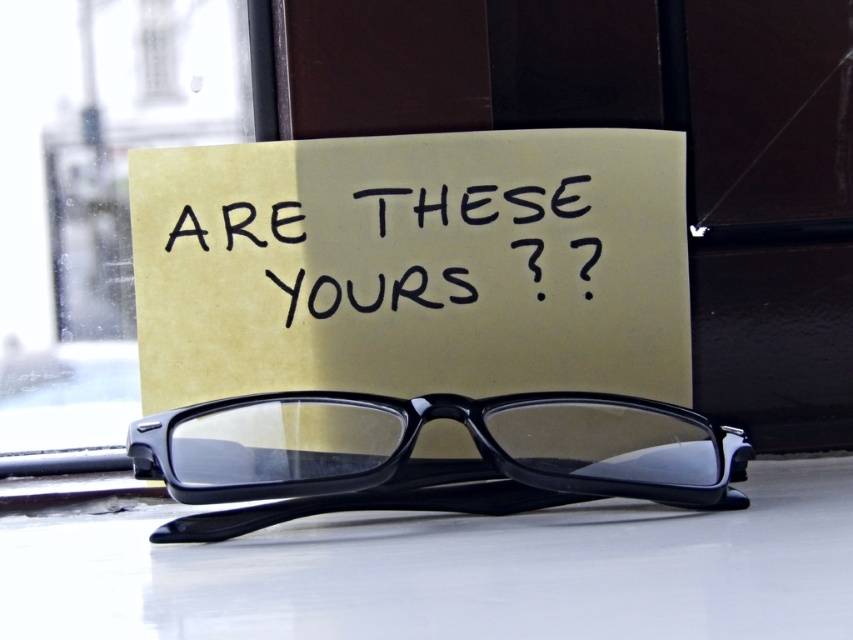
Consider the image. Who is more distant from viewer, (x=393, y=484) or (x=581, y=253)?

The point (x=581, y=253) is behind.

Identify the location of black plastic glasses at center. (428, 458).

Is transparent glass window at upper left positioned at the back of black plastic glasses at center?

Yes, it is.

Is point (200, 83) positioned before point (402, 461)?

No, it is not.

Does point (68, 369) come behind point (460, 481)?

Yes, point (68, 369) is behind point (460, 481).

Find the location of `transparent glass window at upper left`. transparent glass window at upper left is located at coordinates (102, 186).

Which is more to the left, yellow paper at center or transparent glass window at upper left?

From the viewer's perspective, transparent glass window at upper left appears more on the left side.

Identify the location of yellow paper at center. (413, 266).

Is point (578, 180) closer to camera compared to point (71, 173)?

That is True.

Identify the location of yellow paper at center. The image size is (853, 640). point(413,266).